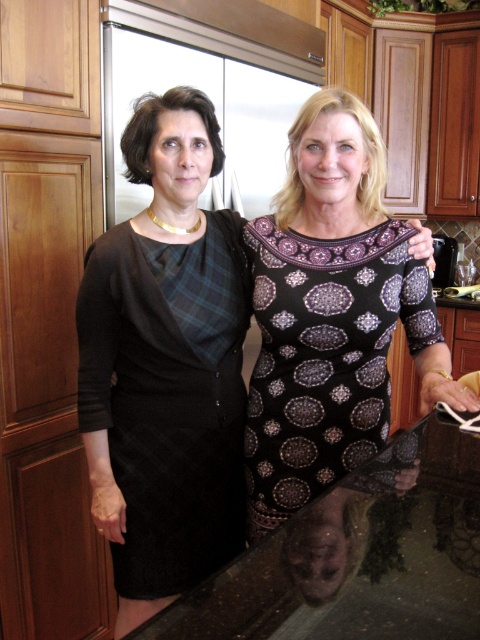
Question: Which point is farther to the camera?

Choices:
 (A) (228, 483)
 (B) (263, 582)
 (C) (345, 276)

Answer: (A)

Question: Among these points, which one is farthest from the camera?

Choices:
 (A) (228, 376)
 (B) (252, 388)
 (C) (459, 433)
 (D) (196, 488)

Answer: (B)

Question: Which of these objects is positioned closest to the shiny black countertop at lower center?

Choices:
 (A) black wool dress at left
 (B) black textured dress at center
 (C) dark purple printed dress at center

Answer: (C)

Question: Is black textured dress at center below shiny black countertop at lower center?

Choices:
 (A) no
 (B) yes

Answer: (A)

Question: Can you confirm if shiny black countertop at lower center is smaller than dark purple printed dress at center?

Choices:
 (A) yes
 (B) no

Answer: (B)

Question: Is black wool dress at left thinner than dark purple printed dress at center?

Choices:
 (A) no
 (B) yes

Answer: (B)